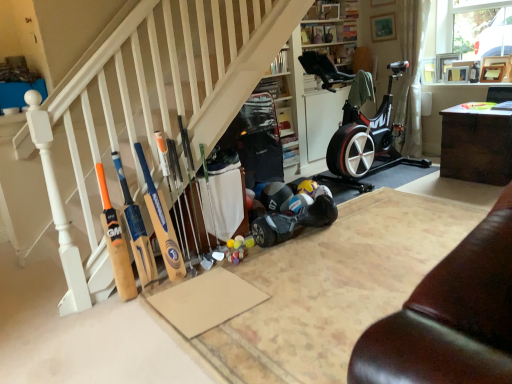
This screenshot has height=384, width=512. In order to click on vacant area that is situated to the right of wooden baseball bat at center, arranged as the first baseball bat when viewed from the right in this screenshot , I will do `click(208, 267)`.